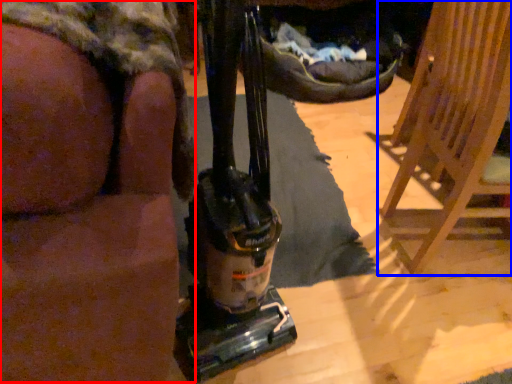
Question: Which point is further to the camera, person (highlighted by a red box) or furniture (highlighted by a blue box)?

Choices:
 (A) person
 (B) furniture

Answer: (B)